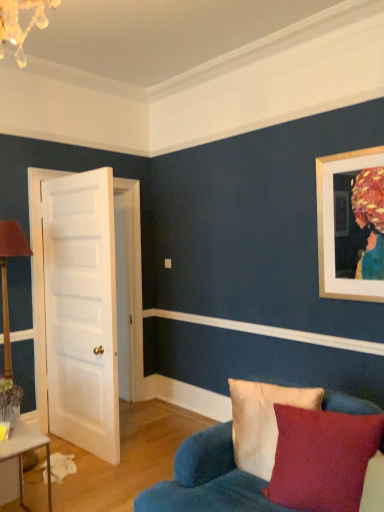
This screenshot has height=512, width=384. Describe the element at coordinates (81, 310) in the screenshot. I see `white smooth door at left` at that location.

Identify the location of white glossy table at lower left. The height and width of the screenshot is (512, 384). (24, 452).

What is the approximate width of white smooth molding at center?

The width of white smooth molding at center is 1.04 inches.

Locate an element on the screen. The height and width of the screenshot is (512, 384). white smooth door at left is located at coordinates (x=81, y=310).

From a real-world perspective, is velvety red pillow at lower right, the first pillow in the front-to-back sequence, under velvet beige pillow at lower right, the 2th pillow in the front-to-back sequence?

Yes, from a real-world perspective, velvety red pillow at lower right, the first pillow in the front-to-back sequence, is below velvet beige pillow at lower right, the 2th pillow in the front-to-back sequence.

You are a GUI agent. You are given a task and a screenshot of the screen. Output one action in this format:
    pyautogui.click(x=<x>, y=<y>)
    Task: Click on the pillow above the velvety red pillow at lower right, the first pillow in the front-to-back sequence (from the image's perspective)
    This screenshot has width=384, height=512.
    Given the screenshot: What is the action you would take?
    pyautogui.click(x=262, y=421)

Does velvety red pillow at lower right, the 2th pillow when ordered from back to front, have a larger size compared to velvet beige pillow at lower right, marked as the first pillow in a back-to-front arrangement?

Correct, velvety red pillow at lower right, the 2th pillow when ordered from back to front, is larger in size than velvet beige pillow at lower right, marked as the first pillow in a back-to-front arrangement.

Considering the relative sizes of velvety red pillow at lower right, the first pillow in the front-to-back sequence, and velvet beige pillow at lower right, the 2th pillow in the front-to-back sequence, in the image provided, is velvety red pillow at lower right, the first pillow in the front-to-back sequence, shorter than velvet beige pillow at lower right, the 2th pillow in the front-to-back sequence,?

Yes.

Is white glossy table at lower left facing towards white smooth door at left?

No, white glossy table at lower left does not turn towards white smooth door at left.

The image size is (384, 512). I want to click on door located on the right of white glossy table at lower left, so pos(81,310).

Considering the relative sizes of white glossy table at lower left and white smooth door at left in the image provided, is white glossy table at lower left smaller than white smooth door at left?

Indeed, white glossy table at lower left has a smaller size compared to white smooth door at left.

Consider the image. Is velvet blue couch at lower right positioned with its back to white glossy table at lower left?

No, white glossy table at lower left is not at the back of velvet blue couch at lower right.

Which is closer to the camera, [200,487] or [30,449]?

Point [200,487] is positioned closer to the camera compared to point [30,449].

Is velvet blue couch at lower right to the left of white glossy table at lower left from the viewer's perspective?

No, velvet blue couch at lower right is not to the left of white glossy table at lower left.

Who is smaller, velvet blue couch at lower right or white glossy table at lower left?

With smaller size is white glossy table at lower left.

From the image's perspective, which one is positioned lower, white glossy table at lower left or velvet beige pillow at lower right, the 2th pillow in the front-to-back sequence?

white glossy table at lower left appears lower in the image.

From a real-world perspective, who is located lower, white glossy table at lower left or velvet beige pillow at lower right, the 2th pillow in the front-to-back sequence?

white glossy table at lower left.

Between white glossy table at lower left and velvet beige pillow at lower right, marked as the first pillow in a back-to-front arrangement, which one is positioned behind?

white glossy table at lower left is more distant.

Is velvety red pillow at lower right, the first pillow in the front-to-back sequence, not near white smooth door at left?

Yes, velvety red pillow at lower right, the first pillow in the front-to-back sequence, and white smooth door at left are quite far apart.

Is velvety red pillow at lower right, the first pillow in the front-to-back sequence, to the right of white smooth door at left from the viewer's perspective?

Indeed, velvety red pillow at lower right, the first pillow in the front-to-back sequence, is positioned on the right side of white smooth door at left.

Considering the relative sizes of velvety red pillow at lower right, the first pillow in the front-to-back sequence, and white smooth door at left in the image provided, is velvety red pillow at lower right, the first pillow in the front-to-back sequence, shorter than white smooth door at left?

Yes, velvety red pillow at lower right, the first pillow in the front-to-back sequence, is shorter than white smooth door at left.

Is white smooth door at left bigger than velvet beige pillow at lower right, marked as the first pillow in a back-to-front arrangement?

Yes, white smooth door at left is bigger than velvet beige pillow at lower right, marked as the first pillow in a back-to-front arrangement.

Are white smooth door at left and velvet beige pillow at lower right, marked as the first pillow in a back-to-front arrangement, far apart?

white smooth door at left is far away from velvet beige pillow at lower right, marked as the first pillow in a back-to-front arrangement.

What's the angular difference between white smooth door at left and velvet beige pillow at lower right, the 2th pillow in the front-to-back sequence,'s facing directions?

The facing directions of white smooth door at left and velvet beige pillow at lower right, the 2th pillow in the front-to-back sequence, are 10.3 degrees apart.

Based on the photo, would you say white smooth door at left is inside or outside velvet beige pillow at lower right, marked as the first pillow in a back-to-front arrangement?

white smooth door at left is located beyond the bounds of velvet beige pillow at lower right, marked as the first pillow in a back-to-front arrangement.

From a real-world perspective, is white smooth molding at center located higher than velvety red pillow at lower right, the 2th pillow when ordered from back to front?

Yes, from a real-world perspective, white smooth molding at center is over velvety red pillow at lower right, the 2th pillow when ordered from back to front

Is white smooth molding at center next to velvety red pillow at lower right, the first pillow in the front-to-back sequence, and touching it?

No.

How distant is white smooth molding at center from velvety red pillow at lower right, the first pillow in the front-to-back sequence?

white smooth molding at center is 4.06 feet from velvety red pillow at lower right, the first pillow in the front-to-back sequence.

Find the location of a particular element. pillow above the velvety red pillow at lower right, the 2th pillow when ordered from back to front (from the image's perspective) is located at coordinates (262, 421).

The image size is (384, 512). In order to click on table below the white smooth door at left (from a real-world perspective) in this screenshot , I will do `click(24, 452)`.

Considering their positions, is velvety red pillow at lower right, the first pillow in the front-to-back sequence, positioned further to velvet beige pillow at lower right, the 2th pillow in the front-to-back sequence, than white smooth molding at center?

white smooth molding at center is positioned further to the anchor velvet beige pillow at lower right, the 2th pillow in the front-to-back sequence.

From the image, which object appears to be farther from white smooth molding at center, velvet beige pillow at lower right, marked as the first pillow in a back-to-front arrangement, or velvet blue couch at lower right?

Based on the image, velvet blue couch at lower right appears to be further to white smooth molding at center.

Estimate the real-world distances between objects in this image. Which object is closer to white smooth molding at center, white glossy table at lower left or white smooth door at left?

The object closer to white smooth molding at center is white smooth door at left.

Considering their positions, is velvet blue couch at lower right positioned further to velvet beige pillow at lower right, the 2th pillow in the front-to-back sequence, than white smooth molding at center?

The object further to velvet beige pillow at lower right, the 2th pillow in the front-to-back sequence, is white smooth molding at center.

When comparing their distances from white smooth door at left, does white glossy table at lower left or velvet blue couch at lower right seem further?

velvet blue couch at lower right is further to white smooth door at left.

Which object lies further to the anchor point white smooth molding at center, velvet beige pillow at lower right, marked as the first pillow in a back-to-front arrangement, or velvety red pillow at lower right, the 2th pillow when ordered from back to front?

Among the two, velvety red pillow at lower right, the 2th pillow when ordered from back to front, is located further to white smooth molding at center.

From the image, which object appears to be farther from velvet beige pillow at lower right, marked as the first pillow in a back-to-front arrangement, white glossy table at lower left or velvety red pillow at lower right, the 2th pillow when ordered from back to front?

Based on the image, white glossy table at lower left appears to be further to velvet beige pillow at lower right, marked as the first pillow in a back-to-front arrangement.

Estimate the real-world distances between objects in this image. Which object is further from white smooth door at left, velvet blue couch at lower right or white smooth molding at center?

The object further to white smooth door at left is velvet blue couch at lower right.

Find the location of `molding located between white glossy table at lower left and velvety red pillow at lower right, the 2th pillow when ordered from back to front, in the left-right direction`. molding located between white glossy table at lower left and velvety red pillow at lower right, the 2th pillow when ordered from back to front, in the left-right direction is located at coordinates (270, 331).

Locate an element on the screen. Image resolution: width=384 pixels, height=512 pixels. door between white glossy table at lower left and white smooth molding at center from left to right is located at coordinates (81, 310).

Locate an element on the screen. This screenshot has width=384, height=512. studio couch between white glossy table at lower left and velvety red pillow at lower right, the first pillow in the front-to-back sequence is located at coordinates (207, 480).

Locate an element on the screen. This screenshot has height=512, width=384. pillow positioned between velvety red pillow at lower right, the first pillow in the front-to-back sequence, and white smooth molding at center from near to far is located at coordinates (262, 421).